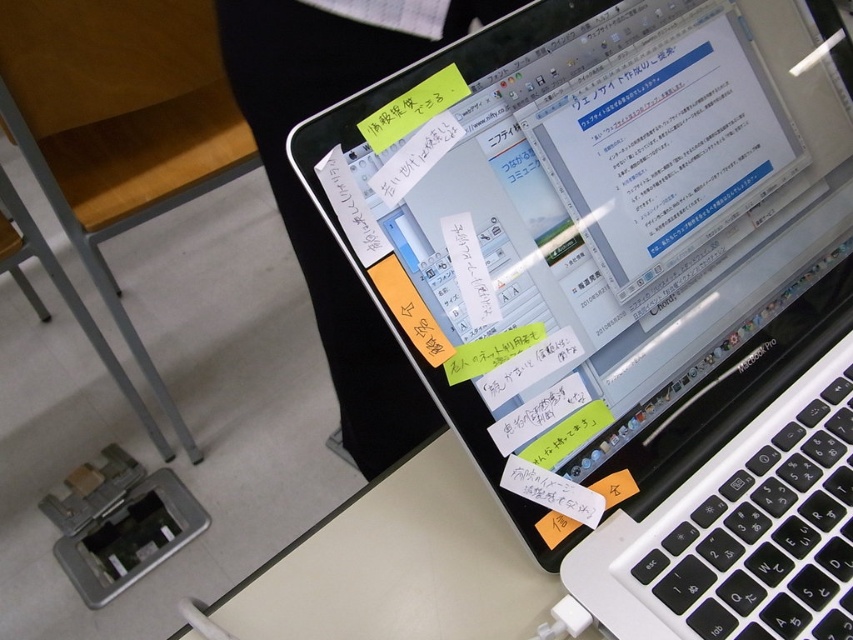
Which is behind, point (770, 346) or point (483, 346)?

The point (770, 346) is behind.

Can you confirm if white plastic laptop at center is bigger than yellow sticky note at center?

Indeed, white plastic laptop at center has a larger size compared to yellow sticky note at center.

Does point (526, 172) lie in front of point (485, 349)?

No, (526, 172) is behind (485, 349).

This screenshot has height=640, width=853. What are the coordinates of `white plastic laptop at center` in the screenshot? It's located at (634, 296).

Can you confirm if yellow sticky note at upper center is shorter than yellow sticky note at center?

No, yellow sticky note at upper center is not shorter than yellow sticky note at center.

Can you confirm if yellow sticky note at upper center is positioned above yellow sticky note at center?

A: Indeed, yellow sticky note at upper center is positioned over yellow sticky note at center.

Locate an element on the screen. yellow sticky note at upper center is located at coordinates (413, 108).

Which is above, white plastic laptop at center or yellow sticky note at upper center?

yellow sticky note at upper center is higher up.

At what (x,y) coordinates should I click in order to perform the action: click on white plastic laptop at center. Please return your answer as a coordinate pair (x, y). Looking at the image, I should click on (634, 296).

Who is more distant from viewer, (363, 163) or (381, 113)?

Point (381, 113)

I want to click on white plastic laptop at center, so click(634, 296).